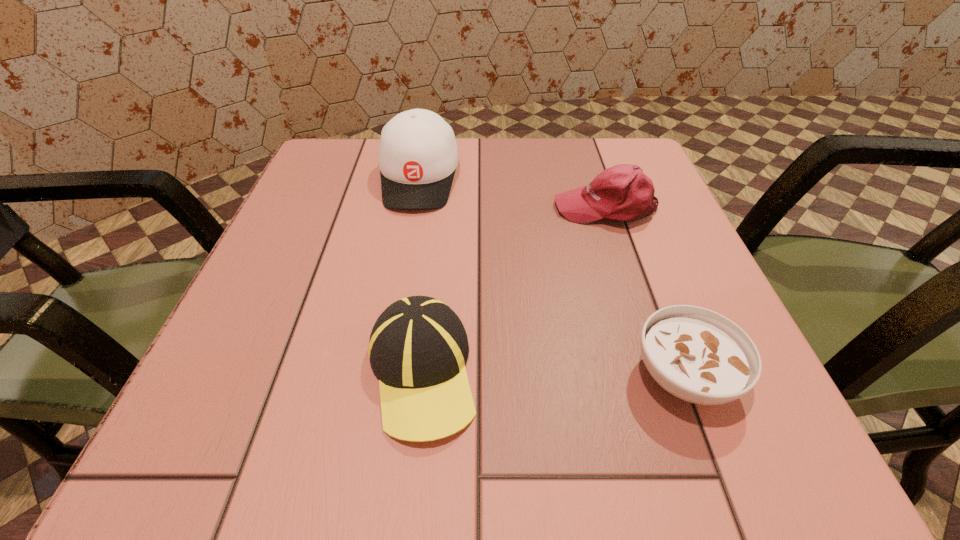
Image resolution: width=960 pixels, height=540 pixels. Find the location of `the tallest object`. the tallest object is located at coordinates (418, 155).

At what (x,y) coordinates should I click in order to perform the action: click on the rightmost baseball cap. Please return your answer as a coordinate pair (x, y). Looking at the image, I should click on (623, 192).

The width and height of the screenshot is (960, 540). Find the location of `the nearest baseball cap`. the nearest baseball cap is located at coordinates (418, 347).

Where is `the shortest object`? This screenshot has height=540, width=960. the shortest object is located at coordinates (697, 355).

At what (x,y) coordinates should I click in order to perform the action: click on free point located 0.260m on the front-facing side of the tallest object. Please return your answer as a coordinate pair (x, y). Image resolution: width=960 pixels, height=540 pixels. Looking at the image, I should click on point(394,322).

At what (x,y) coordinates should I click in order to perform the action: click on vacant space situated 0.180m at the front of the rightmost baseball cap with the brim. Please return your answer as a coordinate pair (x, y). This screenshot has height=540, width=960. Looking at the image, I should click on (461, 207).

This screenshot has width=960, height=540. In order to click on vacant area situated at the front of the rightmost baseball cap with the brim in this screenshot , I will do `click(362, 207)`.

Identify the location of free space located 0.070m at the front of the rightmost baseball cap with the brim. (518, 207).

Locate an element on the screen. This screenshot has width=960, height=540. vacant region located 0.270m on the back of the shortest object is located at coordinates (625, 219).

Locate an element on the screen. The height and width of the screenshot is (540, 960). baseball cap located in the near edge section of the desktop is located at coordinates (418, 347).